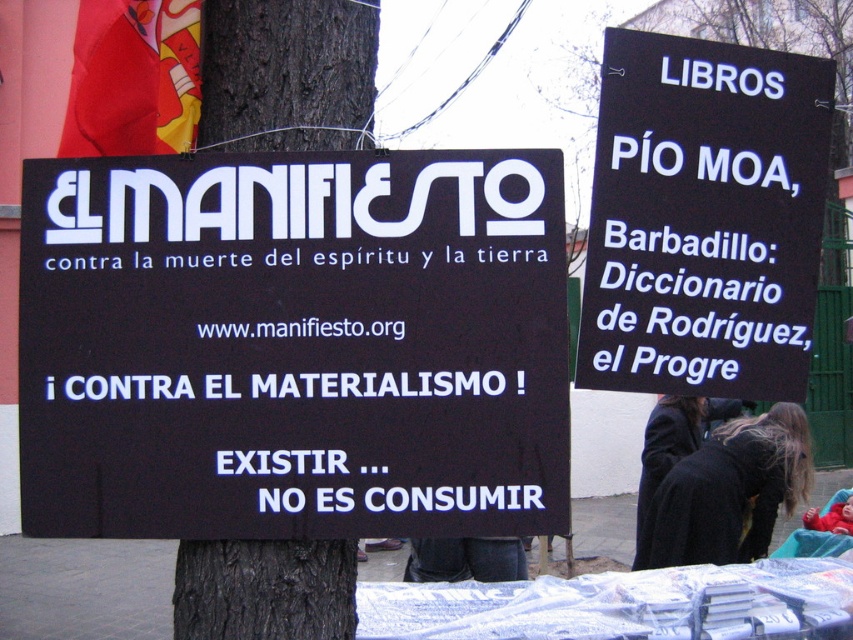
Question: Does black matte sign at center appear on the left side of black paper sign at upper right?

Choices:
 (A) no
 (B) yes

Answer: (B)

Question: Which object is the farthest from the denim pants at lower center?

Choices:
 (A) black paper sign at upper right
 (B) black wood pole at left
 (C) black matte sign at center

Answer: (B)

Question: Which point is closer to the camera?

Choices:
 (A) black paper sign at upper right
 (B) black wool coat at lower right
 (C) denim pants at lower center
 (D) black wood pole at left

Answer: (D)

Question: Among these points, which one is nearest to the camera?

Choices:
 (A) (688, 483)
 (B) (631, 216)
 (C) (129, 438)
 (D) (434, 577)

Answer: (C)

Question: Can you confirm if black wool coat at lower right is wider than denim pants at lower center?

Choices:
 (A) yes
 (B) no

Answer: (A)

Question: In this image, where is black wood pole at left located relative to black wool coat at lower right?

Choices:
 (A) above
 (B) below

Answer: (A)